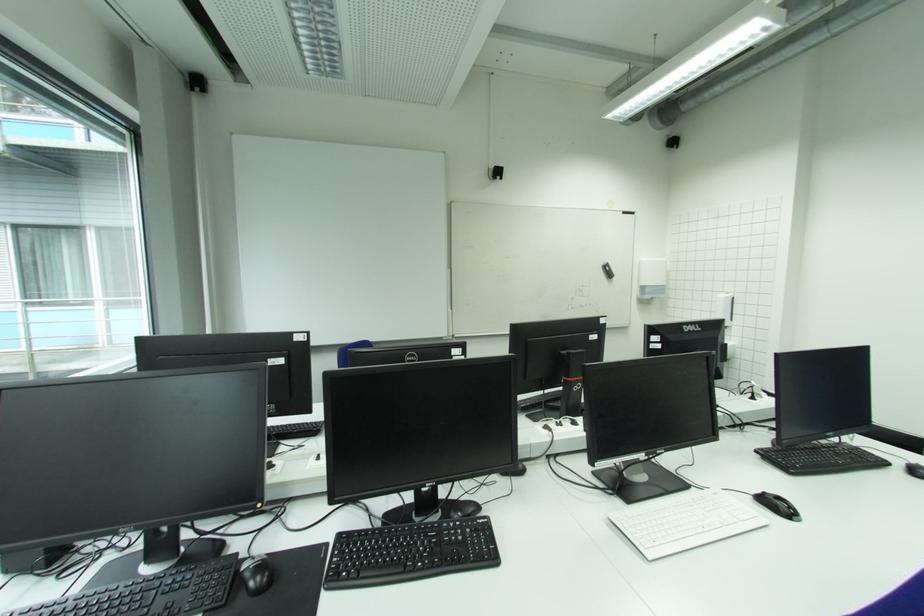
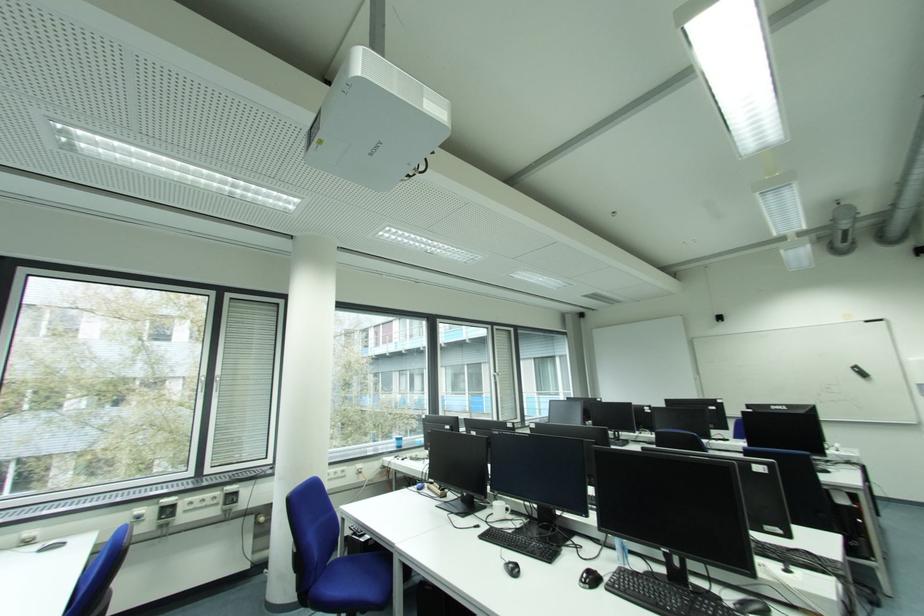
Where in the second image is the point corresponding to the point at 614,276 from the first image?

(869, 376)